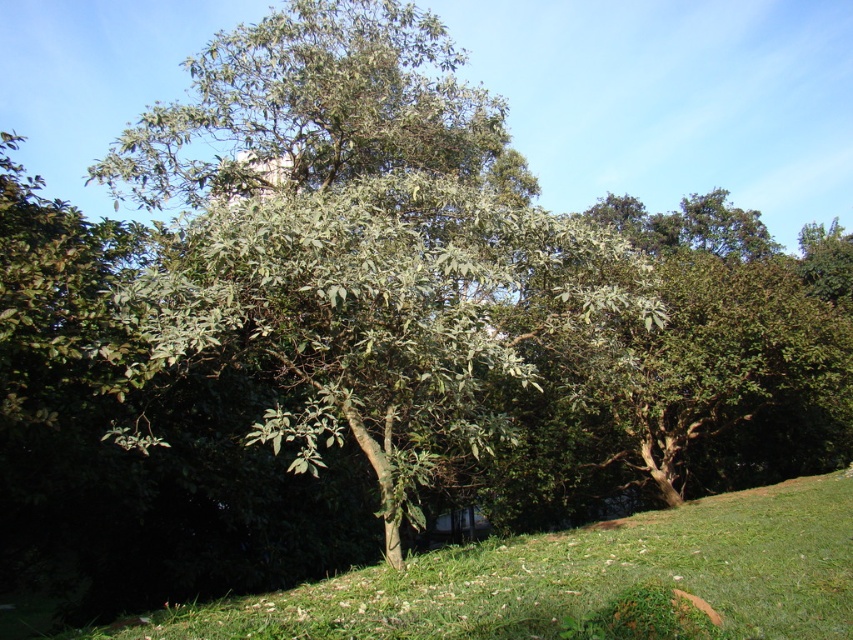
Between point (560, 236) and point (595, 525), which one is positioned behind?

Positioned behind is point (595, 525).

Does green leafy tree at center come behind green grassy at lower center?

That is True.

Between point (393, 468) and point (769, 611), which one is positioned in front?

Point (769, 611) is more forward.

Locate an element on the screen. green leafy tree at center is located at coordinates (364, 243).